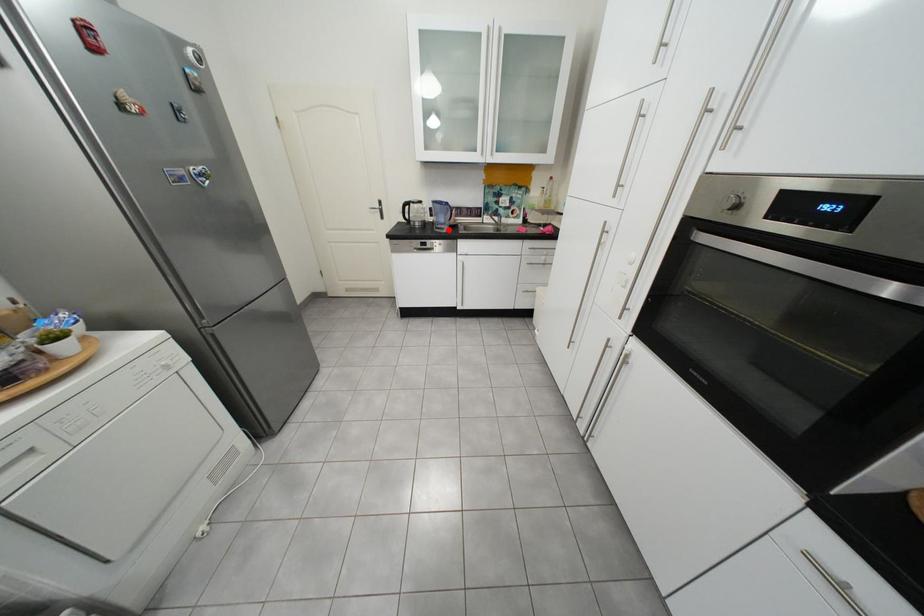
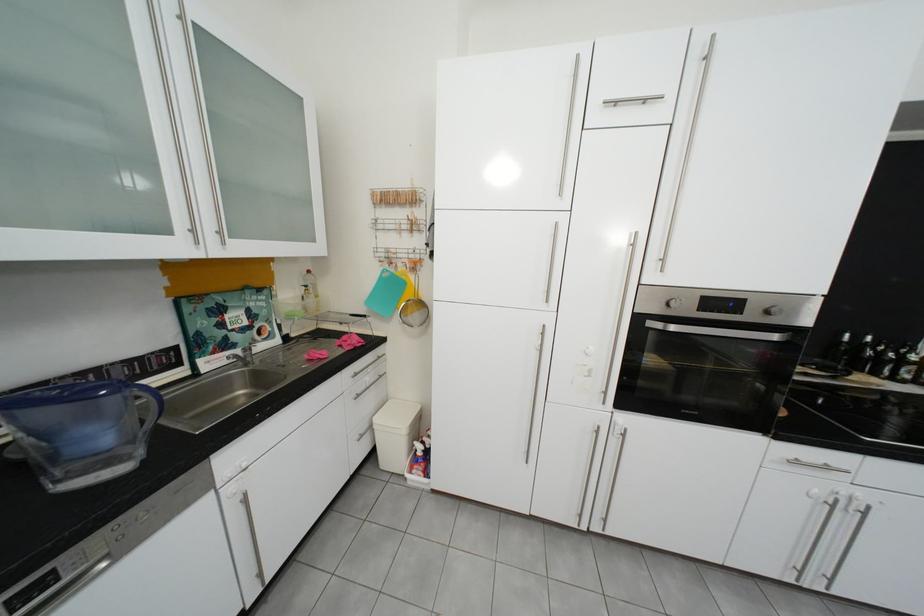
The point at the highlighted location is marked in the first image. Where is the corresponding point in the second image?

(70, 483)